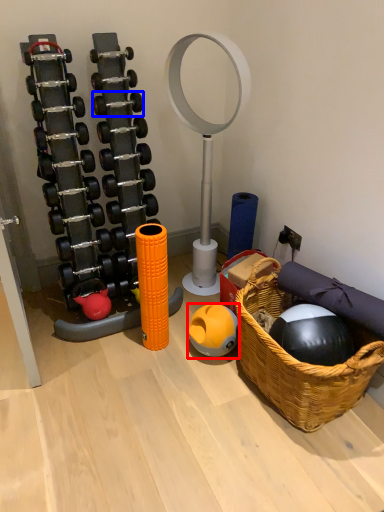
Question: Which object is closer to the camera taking this photo, ball (highlighted by a red box) or dumbbell (highlighted by a blue box)?

Choices:
 (A) ball
 (B) dumbbell

Answer: (A)